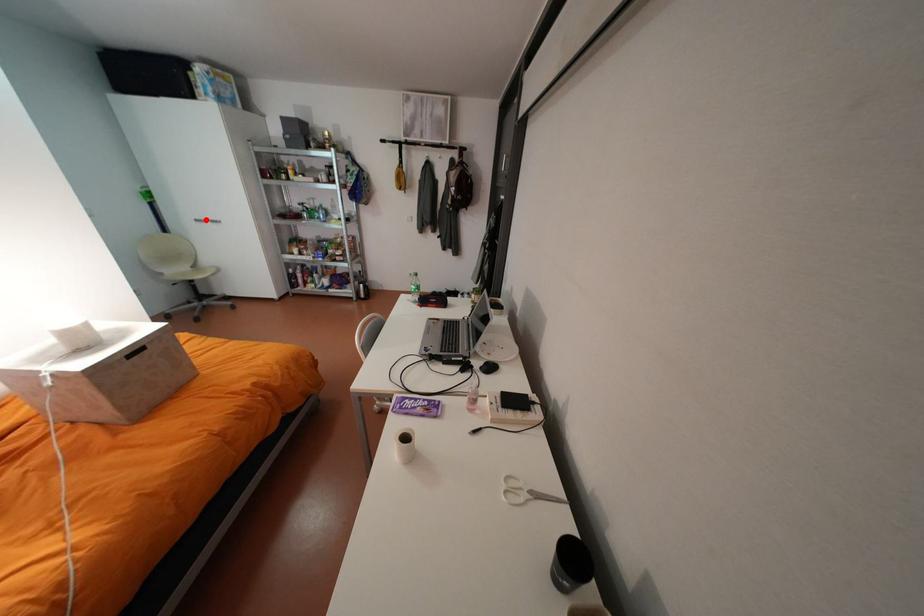
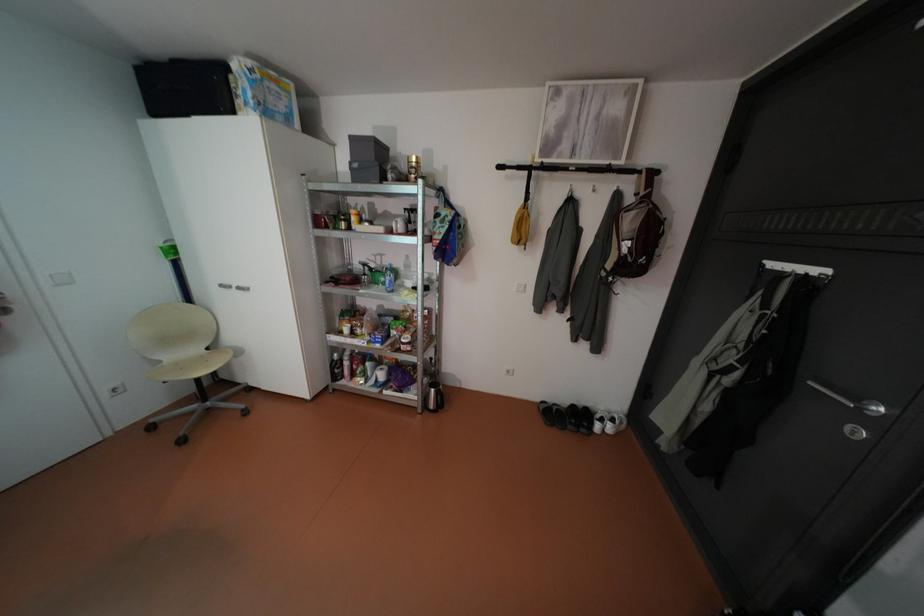
The point at the highlighted location is marked in the first image. Where is the corresponding point in the second image?

(232, 285)